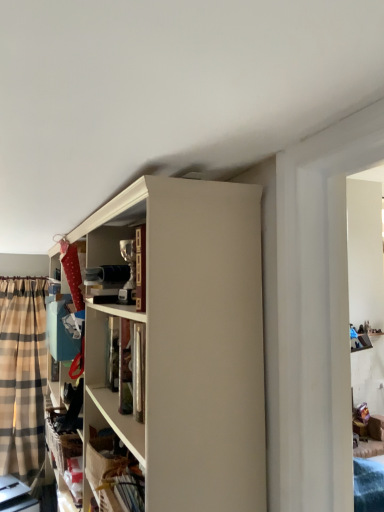
Question: Is point coord(31,303) positioned closer to the camera than point coord(120,253)?

Choices:
 (A) farther
 (B) closer

Answer: (A)

Question: Is plaid fabric curtain at left inside the boundaries of metallic silver trophy at upper center, or outside?

Choices:
 (A) outside
 (B) inside

Answer: (A)

Question: From a real-world perspective, is plaid fabric curtain at left above or below metallic silver trophy at upper center?

Choices:
 (A) below
 (B) above

Answer: (A)

Question: Considering the positions of metallic silver trophy at upper center and plaid fabric curtain at left in the image, is metallic silver trophy at upper center bigger or smaller than plaid fabric curtain at left?

Choices:
 (A) big
 (B) small

Answer: (B)

Question: From the image's perspective, is metallic silver trophy at upper center positioned above or below plaid fabric curtain at left?

Choices:
 (A) above
 (B) below

Answer: (A)

Question: Is metallic silver trophy at upper center wider or thinner than plaid fabric curtain at left?

Choices:
 (A) wide
 (B) thin

Answer: (B)

Question: Which is correct: metallic silver trophy at upper center is inside plaid fabric curtain at left, or outside of it?

Choices:
 (A) inside
 (B) outside

Answer: (B)